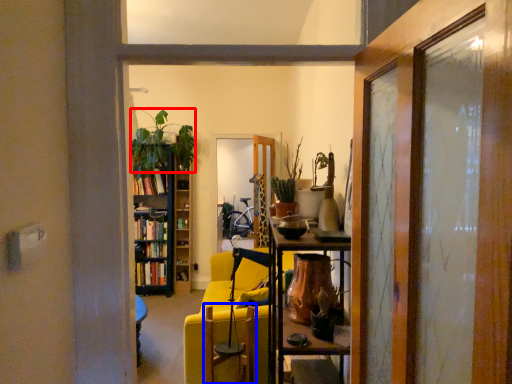
Question: Which object is further to the camera taking this photo, houseplant (highlighted by a red box) or swivel chair (highlighted by a blue box)?

Choices:
 (A) houseplant
 (B) swivel chair

Answer: (A)